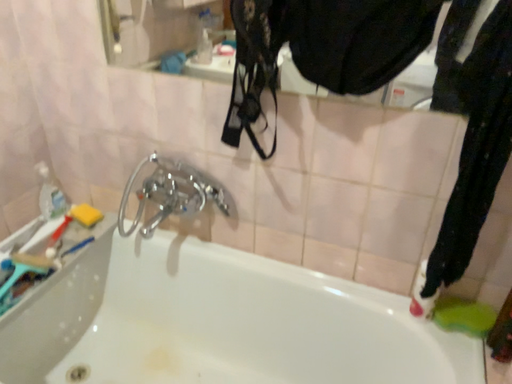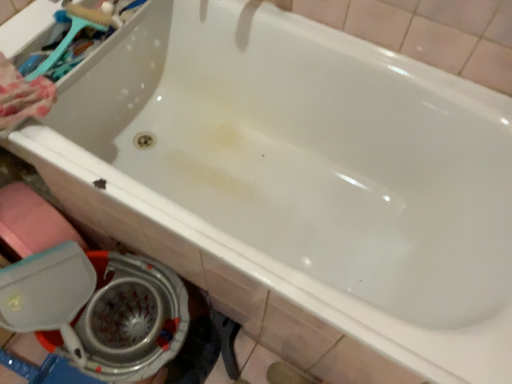
Question: Which way did the camera rotate in the video?

Choices:
 (A) rotated right
 (B) rotated left

Answer: (B)